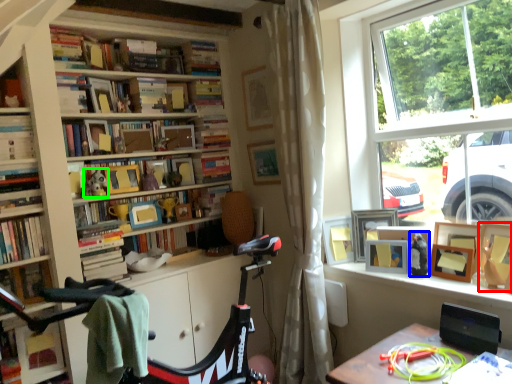
Question: Based on their relative distances, which object is nearer to picture frame (highlighted by a red box)? Choose from toy (highlighted by a blue box) and toy (highlighted by a green box).

Choices:
 (A) toy
 (B) toy

Answer: (A)